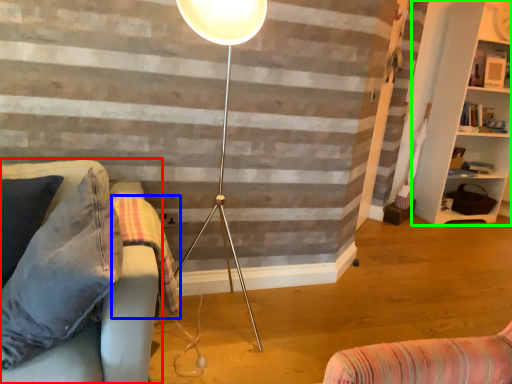
Question: Which is nearer to the studio couch (highlighted by a red box)? blanket (highlighted by a blue box) or shelf (highlighted by a green box).

Choices:
 (A) blanket
 (B) shelf

Answer: (A)